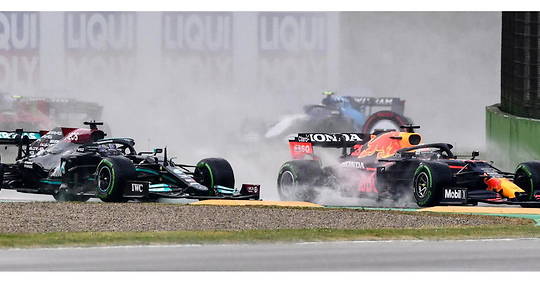
Find the location of a particular element. The height and width of the screenshot is (282, 540). wall is located at coordinates (528, 129).